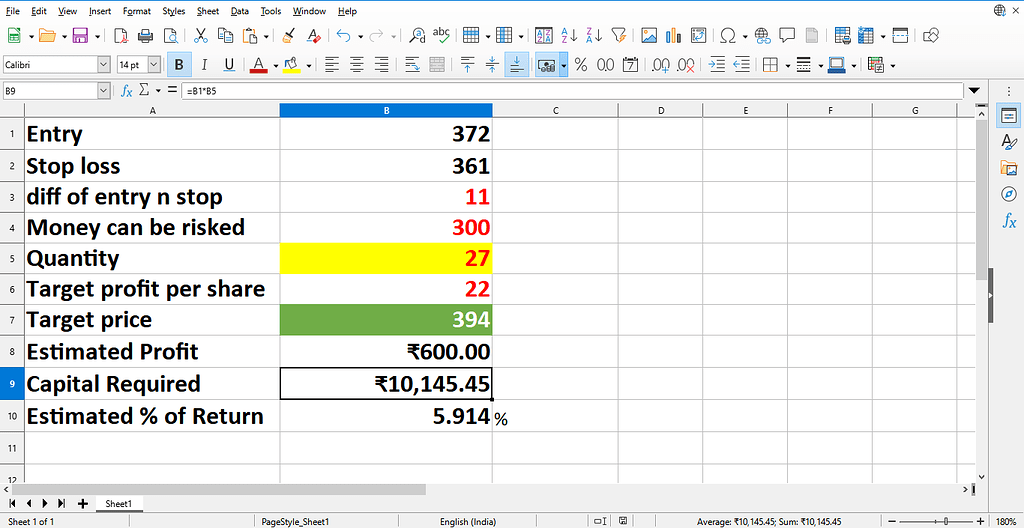
Find the location of a particular element. Image resolution: width=1024 pixels, height=528 pixels. columns is located at coordinates (142, 109), (387, 109), (565, 111), (674, 108), (778, 109), (830, 108), (930, 111), (963, 110).